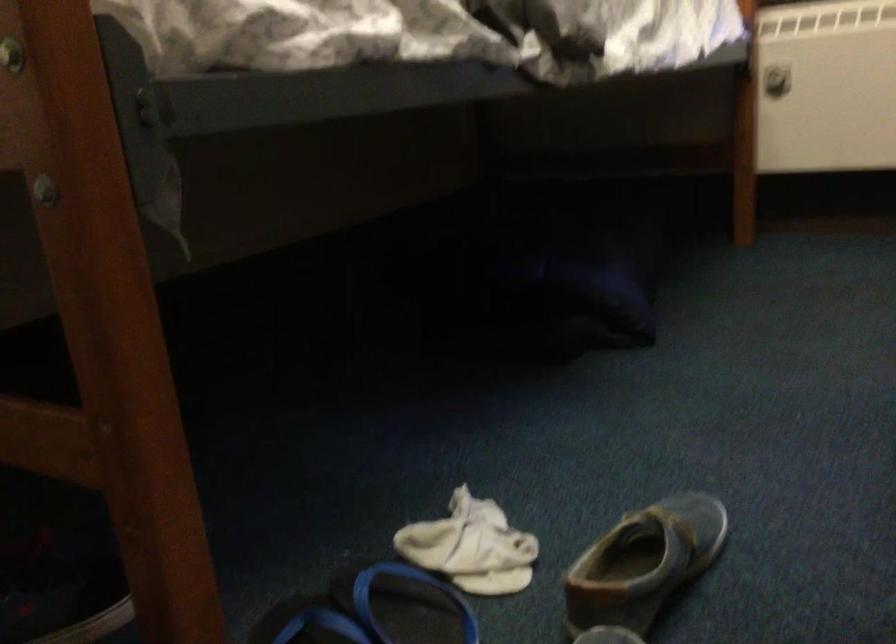
In order to click on radiator knob in this screenshot , I will do `click(776, 80)`.